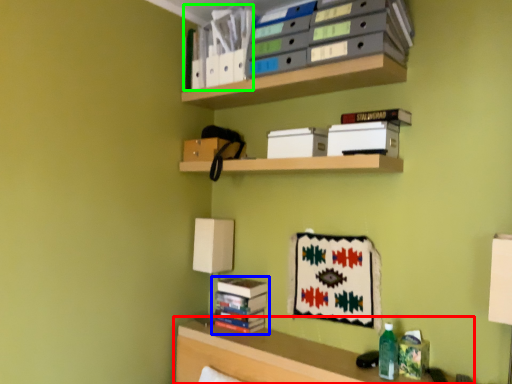
Question: Estimate the real-world distances between objects in this image. Which object is farther from shelf (highlighted by a red box), book (highlighted by a blue box) or book (highlighted by a green box)?

Choices:
 (A) book
 (B) book

Answer: (B)